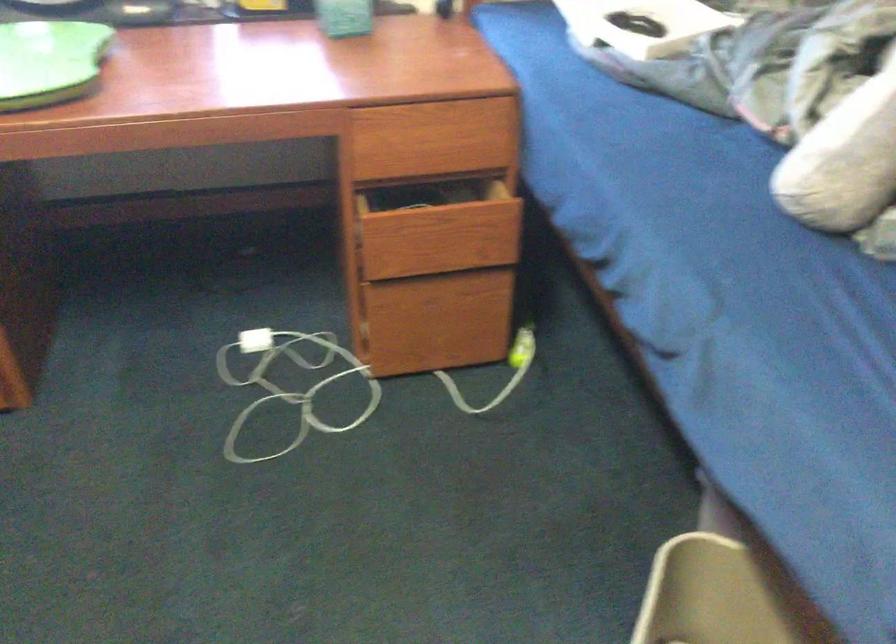
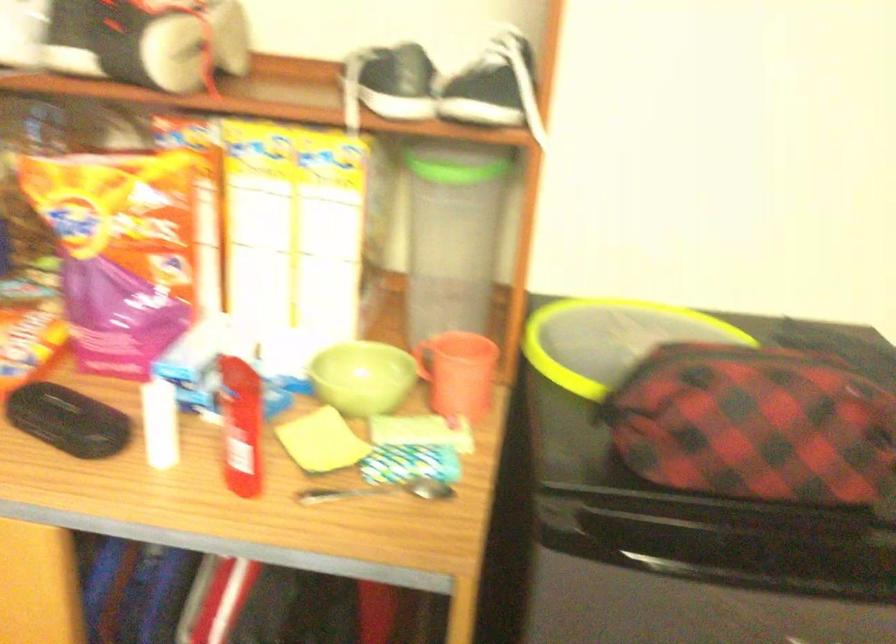
Based on the continuous images, in which direction is the camera rotating?

The camera rotated toward right-down.